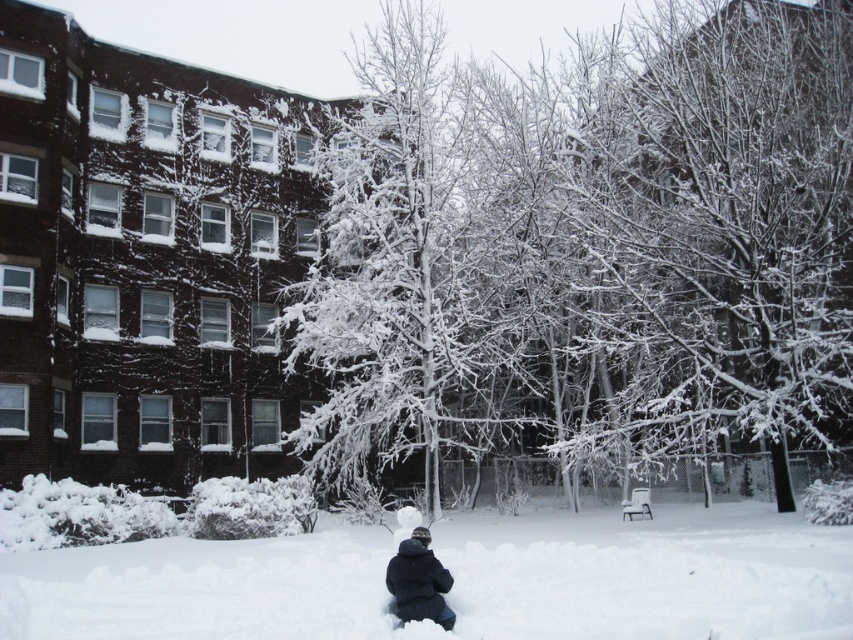
You are a photographer planning to take a picture of the white frosty tree at center and the white fluffy snow at lower center. Which object should you focus on first to ensure both are in the frame without moving the camera?

The white frosty tree at center should be focused on first since it is larger than the white fluffy snow at lower center, allowing you to adjust the framing to include both objects.